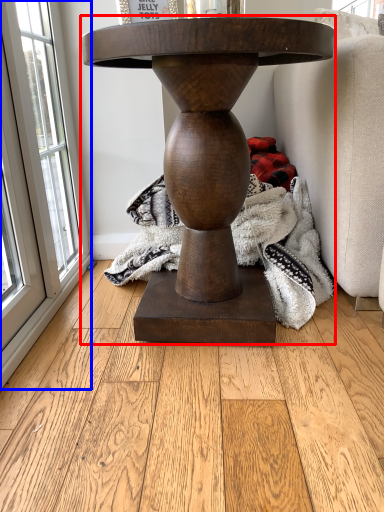
Question: Which object appears closest to the camera in this image, table (highlighted by a red box) or window (highlighted by a blue box)?

Choices:
 (A) table
 (B) window

Answer: (A)